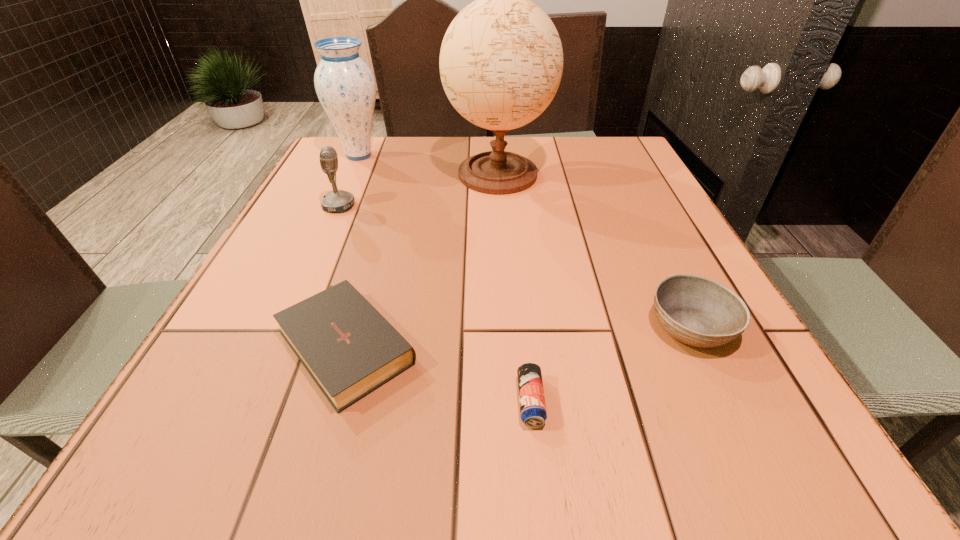
Find the location of a particular element. the tallest object is located at coordinates (501, 60).

This screenshot has width=960, height=540. Find the location of `the second tallest object`. the second tallest object is located at coordinates (345, 85).

Where is `microphone`? microphone is located at coordinates (338, 201).

Locate an element on the screen. The image size is (960, 540). bowl is located at coordinates (698, 311).

You are a GUI agent. You are given a task and a screenshot of the screen. Output one action in this format:
    pyautogui.click(x=<x>, y=<y>)
    Task: Click on the third shortest object
    
    Given the screenshot: What is the action you would take?
    pyautogui.click(x=698, y=311)

Find the location of a particular element. Bible is located at coordinates (349, 349).

Where is `the shortest object`? The height and width of the screenshot is (540, 960). the shortest object is located at coordinates (533, 413).

What are the coordinates of `free space located on the surface of the tallest object` in the screenshot? It's located at (507, 319).

This screenshot has width=960, height=540. I want to click on vacant space positioned 0.250m on the right of the vase, so click(x=471, y=156).

Where is `vacant space located on the front-facing side of the microphone`? The height and width of the screenshot is (540, 960). vacant space located on the front-facing side of the microphone is located at coordinates (384, 206).